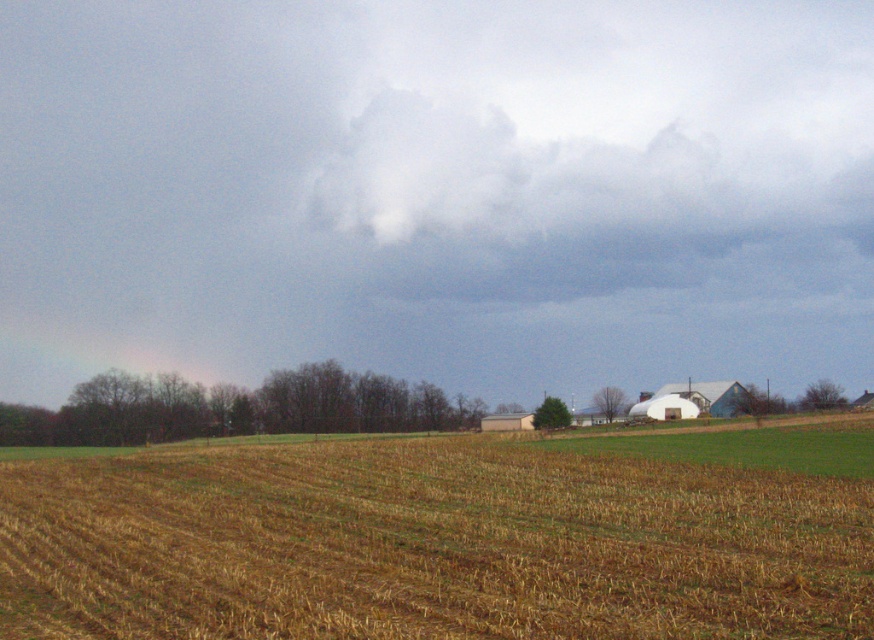
You are a farmer standing in the middle of the field and looking up at the sky. Can you see the white fluffy cloud at upper center above the brown straw at center?

Yes, the white fluffy cloud at upper center is located above the brown straw at center, so you can see it above the straw.

Based on the photo, you are standing in the middle of the freshly harvested field in the rural landscape. Looking up, you see the white fluffy cloud at upper center. If you were to draw a straight line from your eye level to the cloud, which direction would you be facing? Remember, the cloud is located at coordinates approximately 0.302 on the x and 0.500 on the y axis of the image.

Since the white fluffy cloud at upper center is located at point 0.302 on the x and 0.500 on the y axis, you would be facing towards the upper center direction to draw a straight line from your eye level to the cloud.